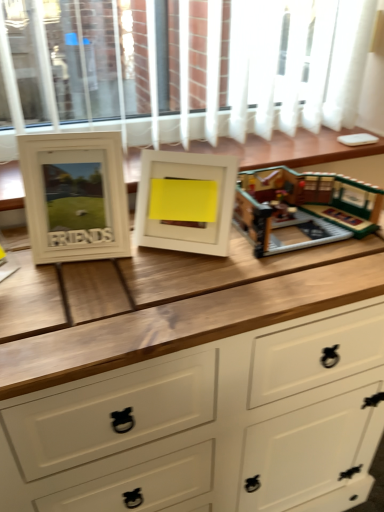
Question: Is white matte picture frame at center, which is the 1th picture frame in right-to-left order, in front of white matte picture frame at left, the 2th picture frame positioned from the right?

Choices:
 (A) no
 (B) yes

Answer: (A)

Question: Can you confirm if white matte picture frame at center, which ranks as the second picture frame in left-to-right order, is bigger than white matte picture frame at left, the 2th picture frame positioned from the right?

Choices:
 (A) no
 (B) yes

Answer: (A)

Question: From a real-world perspective, is white matte picture frame at center, which is the 1th picture frame in right-to-left order, beneath white matte picture frame at left, the 2th picture frame positioned from the right?

Choices:
 (A) no
 (B) yes

Answer: (B)

Question: Can you confirm if white matte picture frame at center, which is the 1th picture frame in right-to-left order, is shorter than white matte picture frame at left, the 2th picture frame positioned from the right?

Choices:
 (A) yes
 (B) no

Answer: (A)

Question: From a real-world perspective, is white matte picture frame at center, which ranks as the second picture frame in left-to-right order, on top of white matte picture frame at left, the first picture frame when ordered from left to right?

Choices:
 (A) yes
 (B) no

Answer: (B)

Question: In the image, is brick-like lego set at center on the left side or the right side of white wooden buffet at center?

Choices:
 (A) right
 (B) left

Answer: (A)

Question: Is point (344, 217) closer or farther from the camera than point (8, 163)?

Choices:
 (A) farther
 (B) closer

Answer: (B)

Question: From the image's perspective, is brick-like lego set at center positioned above or below white wooden buffet at center?

Choices:
 (A) above
 (B) below

Answer: (B)

Question: In the image, is brick-like lego set at center positioned in front of or behind white wooden buffet at center?

Choices:
 (A) behind
 (B) front

Answer: (B)

Question: From a real-world perspective, is white wooden buffet at center above or below brick-like lego set at center?

Choices:
 (A) above
 (B) below

Answer: (A)

Question: Considering the positions of white wooden buffet at center and brick-like lego set at center in the image, is white wooden buffet at center bigger or smaller than brick-like lego set at center?

Choices:
 (A) small
 (B) big

Answer: (B)

Question: Considering the positions of white wooden buffet at center and brick-like lego set at center in the image, is white wooden buffet at center wider or thinner than brick-like lego set at center?

Choices:
 (A) wide
 (B) thin

Answer: (A)

Question: Considering the positions of white wooden buffet at center and brick-like lego set at center in the image, is white wooden buffet at center taller or shorter than brick-like lego set at center?

Choices:
 (A) short
 (B) tall

Answer: (A)

Question: From the image's perspective, relative to brick-like lego set at center, is white wood chest of drawers at center above or below?

Choices:
 (A) above
 (B) below

Answer: (B)

Question: From their relative heights in the image, would you say white wood chest of drawers at center is taller or shorter than brick-like lego set at center?

Choices:
 (A) short
 (B) tall

Answer: (B)